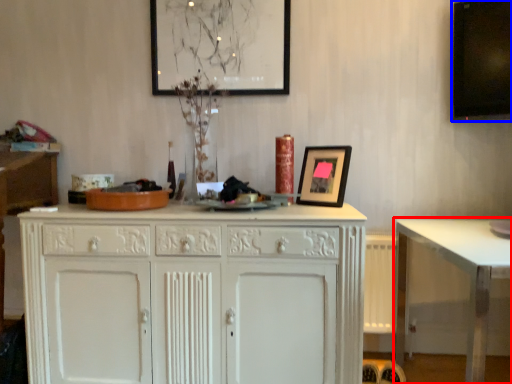
Question: Which object appears farthest to the camera in this image, table (highlighted by a red box) or computer monitor (highlighted by a blue box)?

Choices:
 (A) table
 (B) computer monitor

Answer: (B)